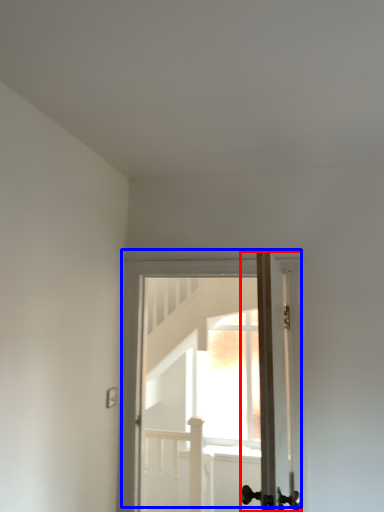
Question: Which of the following is the farthest to the observer, door (highlighted by a red box) or door (highlighted by a blue box)?

Choices:
 (A) door
 (B) door

Answer: (B)